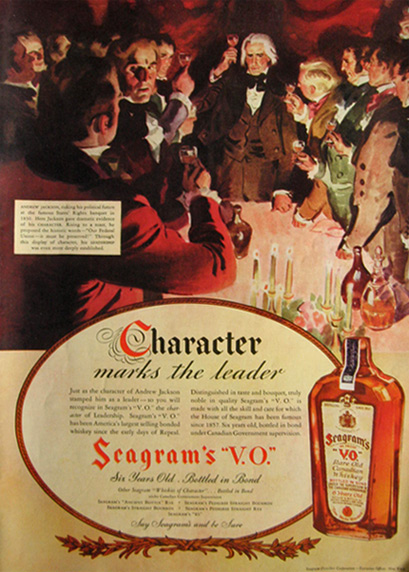
Identify the location of drinking glasses. The width and height of the screenshot is (409, 572). (188, 157), (296, 146), (293, 90), (233, 38), (187, 59).